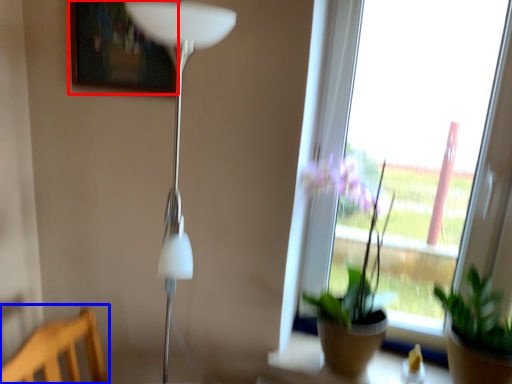
Question: Which point is closer to the camera, picture frame (highlighted by a red box) or furniture (highlighted by a blue box)?

Choices:
 (A) picture frame
 (B) furniture

Answer: (B)